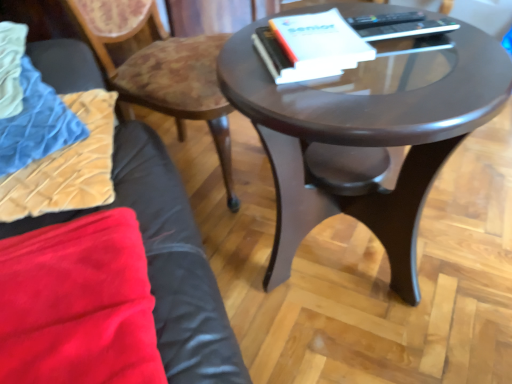
The width and height of the screenshot is (512, 384). Identify the location of vacant space to the right of glossy dark wood coffee table at center. (476, 210).